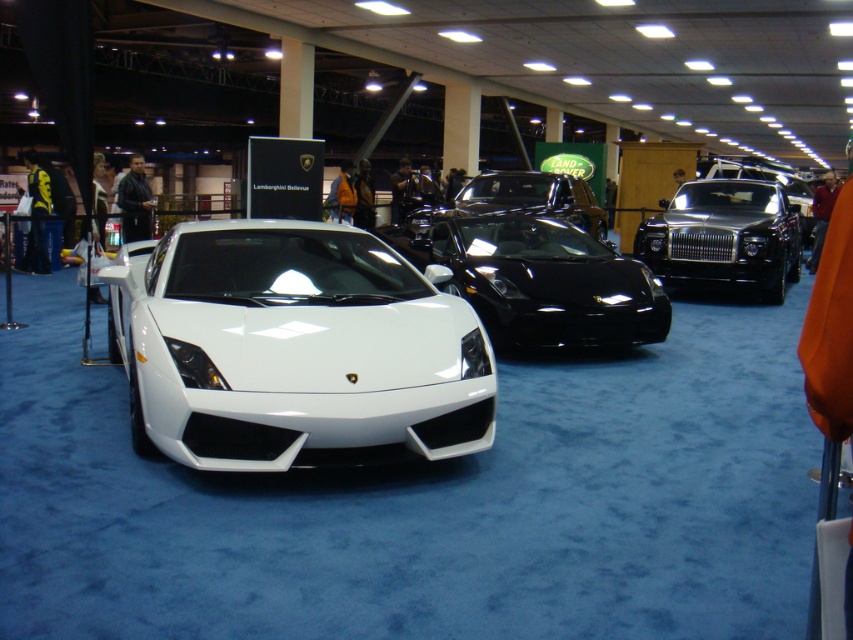
In the scene shown: You are a photographer at the auto show and need to capture a clear shot of the black metallic sedan at right and the glossy black car at center. Since the lighting is even, which car should you focus on first to ensure proper exposure?

The black metallic sedan at right is positioned under the glossy black car at center, so it might be in shadow. Focus on the glossy black car at center first to ensure proper exposure.

You are a parking attendant at the auto show. You need to park a new car that is 2 meters wide. The white glossy sports car at center and the black metallic sedan at right are already parked. Can you fit the new car between them without moving any existing vehicles?

The white glossy sports car at center has a lesser width compared to the black metallic sedan at right. Since the new car is 2 meters wide, and the space between them depends on their widths, the total available space between them would be the sum of their widths subtracted from the total area. However, without knowing the exact distance between them or the total space available, it is impossible to determine if the new car can fit. Please check the actual spacing between the white glossy sports car at the